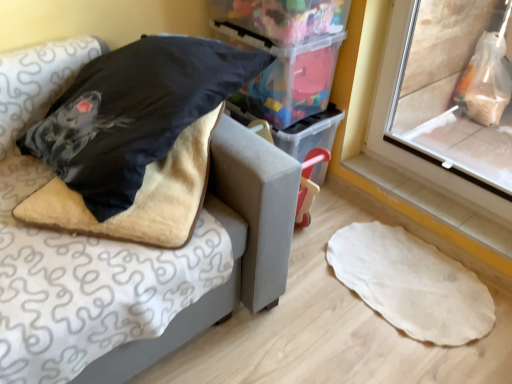
Find the location of a particular element. This screenshot has width=512, height=384. vacant point above white tile at lower right (from a real-world perspective) is located at coordinates (429, 198).